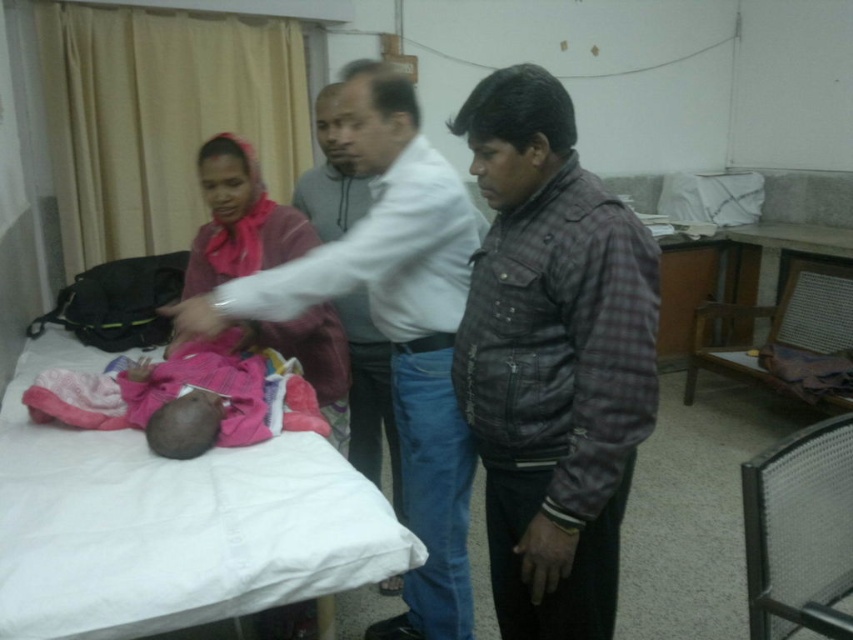
Measure the distance between pink fabric headscarf at upper left and white shirt at center.

8.07 inches

Is point (277, 252) closer to viewer compared to point (329, 173)?

Yes, it is in front of point (329, 173).

Find the location of a particular element. Image resolution: width=853 pixels, height=640 pixels. pink fabric headscarf at upper left is located at coordinates (239, 220).

Find the location of a particular element. This screenshot has width=853, height=640. pink fabric headscarf at upper left is located at coordinates 239,220.

Is white shirt at center further to the viewer compared to white fabric bed at center?

Yes, it is behind white fabric bed at center.

Is white shirt at center wider than white fabric bed at center?

No.

Is point (376, 346) in front of point (236, 490)?

No, it is not.

Where is `white shirt at center`? Image resolution: width=853 pixels, height=640 pixels. white shirt at center is located at coordinates (369, 396).

Is pink fabric baby at lower left thinner than white fabric bed at center?

Indeed, pink fabric baby at lower left has a lesser width compared to white fabric bed at center.

How much distance is there between pink fabric baby at lower left and white fabric bed at center?

Answer: pink fabric baby at lower left and white fabric bed at center are 11.55 inches apart.

Does point (125, 390) come closer to viewer compared to point (27, 355)?

Yes, point (125, 390) is in front of point (27, 355).

The width and height of the screenshot is (853, 640). Identify the location of pink fabric baby at lower left. (184, 397).